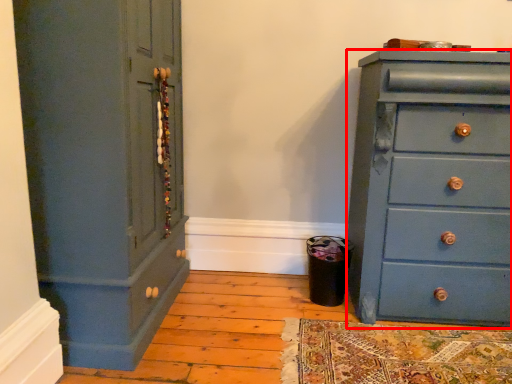
Question: From the image's perspective, where is chest of drawers (annotated by the red box) located relative to cupboard?

Choices:
 (A) below
 (B) above

Answer: (A)